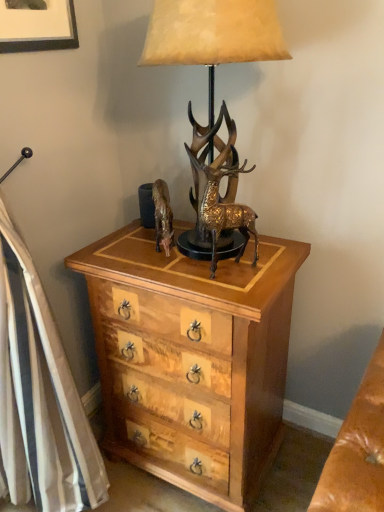
The height and width of the screenshot is (512, 384). Find the location of `vacant region in front of gold textured deer at center`. vacant region in front of gold textured deer at center is located at coordinates (236, 289).